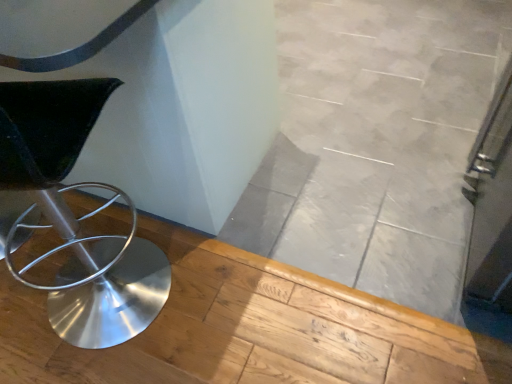
Question: Should I look upward or downward to see black leather chair at left?

Choices:
 (A) down
 (B) up

Answer: (A)